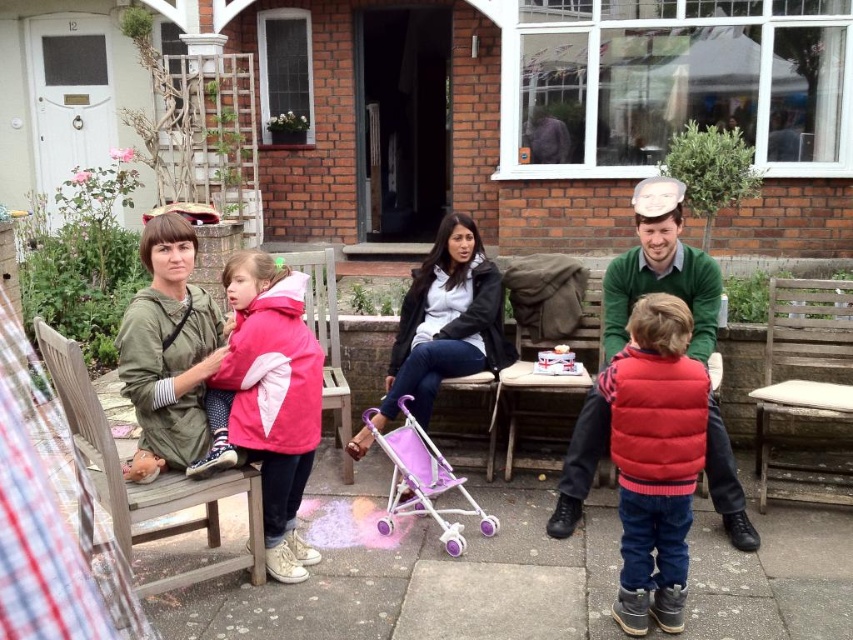
Question: Which point is closer to the camera taking this photo?

Choices:
 (A) (639, 632)
 (B) (538, 600)

Answer: (A)

Question: Which object is the closest to the red puffy vest at center?

Choices:
 (A) pink plastic stroller at center
 (B) pink fleece jacket at left
 (C) matte pink stroller at center

Answer: (C)

Question: Can you confirm if weathered wood chair at right is positioned to the left of pink plastic stroller at center?

Choices:
 (A) no
 (B) yes

Answer: (A)

Question: Does matte pink stroller at center appear under pink fleece jacket at left?

Choices:
 (A) no
 (B) yes

Answer: (B)

Question: Can you confirm if red puffy vest at center is thinner than weathered wood chair at right?

Choices:
 (A) yes
 (B) no

Answer: (A)

Question: Which of these objects is positioned closest to the pink fleece jacket at left?

Choices:
 (A) wooden bench at left
 (B) pink plastic stroller at center
 (C) matte pink stroller at center
 (D) red puffy vest at center

Answer: (A)